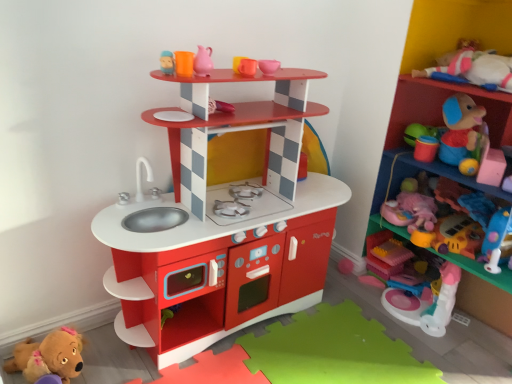
Identify the location of free space that is to the left of pink plastic toy at right, marked as the fourth toy in a top-to-bottom arrangement. (339, 309).